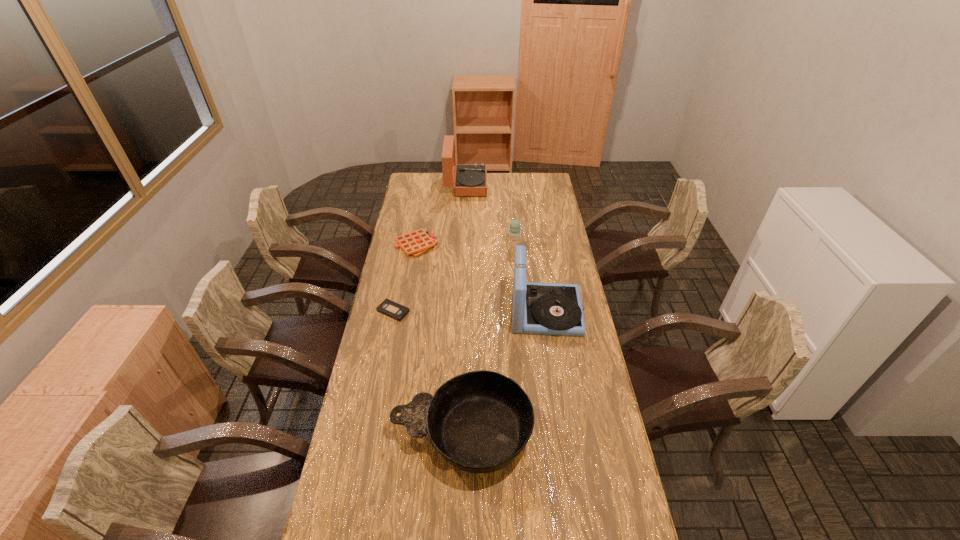
Identify the location of vacant space located 0.060m on the front of the third tallest object. This screenshot has width=960, height=540. (516, 257).

The height and width of the screenshot is (540, 960). I want to click on vacant space located 0.070m with the handle extending from the side of the frying pan, so click(x=370, y=434).

Image resolution: width=960 pixels, height=540 pixels. I want to click on free space located 0.090m with the handle extending from the side of the frying pan, so click(x=364, y=434).

The width and height of the screenshot is (960, 540). I want to click on free space located 0.140m with the handle extending from the side of the frying pan, so tap(348, 434).

Locate an element on the screen. The width and height of the screenshot is (960, 540). vacant space located 0.380m on the right of the waffle is located at coordinates (517, 245).

You are a GUI agent. You are given a task and a screenshot of the screen. Output one action in this format:
    pyautogui.click(x=<x>, y=<y>)
    Task: Click on the vacant space located on the front of the videotape
    Image resolution: width=960 pixels, height=540 pixels.
    Given the screenshot: What is the action you would take?
    pyautogui.click(x=382, y=369)

Where is `object that is at the far edge`? The image size is (960, 540). object that is at the far edge is located at coordinates (470, 180).

Where is `frying pan that is at the left edge`? The image size is (960, 540). frying pan that is at the left edge is located at coordinates (479, 421).

The image size is (960, 540). What are the coordinates of `waffle present at the left edge` in the screenshot? It's located at (415, 243).

At what (x,y) coordinates should I click in order to perform the action: click on videotape present at the left edge. Please return your answer as a coordinate pair (x, y). The image size is (960, 540). Looking at the image, I should click on (388, 307).